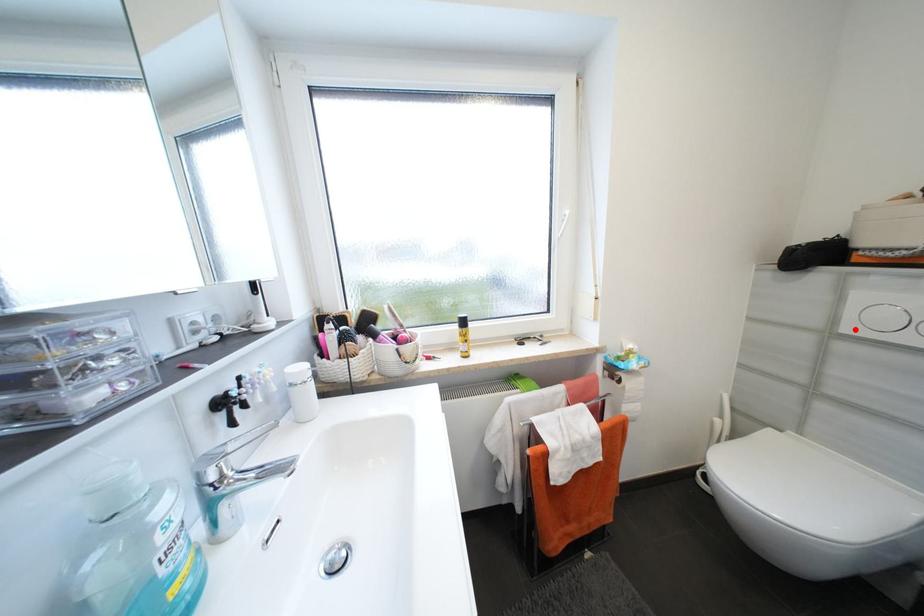
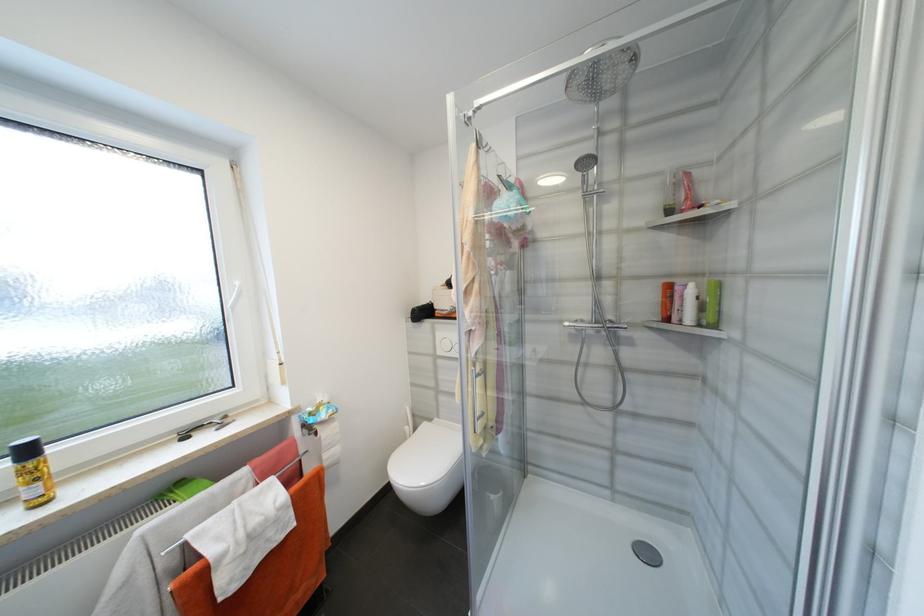
In the second image, find the point that corresponds to the highlighted location in the first image.

(445, 353)